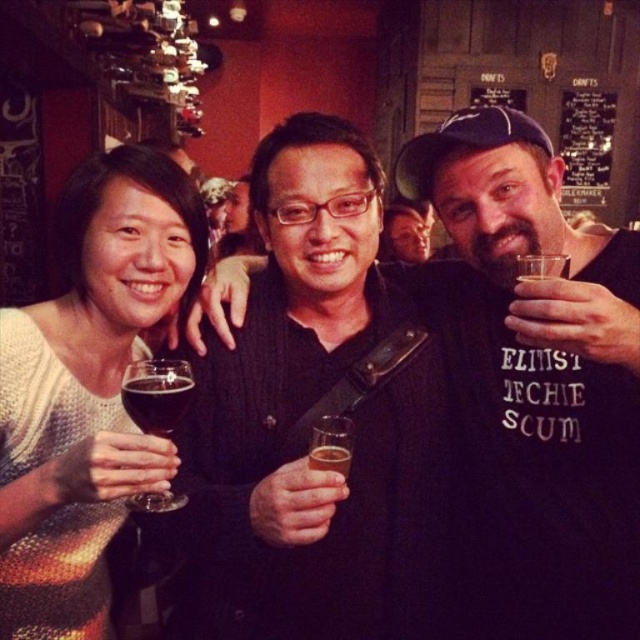
Question: Does dark glass at center appear on the right side of translucent glass at center?

Choices:
 (A) yes
 (B) no

Answer: (B)

Question: Which object is the closest to the black matte shirt at center?

Choices:
 (A) dark glass at center
 (B) knitted sweater at left
 (C) translucent glass at center

Answer: (C)

Question: Estimate the real-world distances between objects in this image. Which object is farther from the black matte shirt at center?

Choices:
 (A) dark glass at left
 (B) knitted sweater at left
 (C) dark glass at center
 (D) translucent glass at center

Answer: (B)

Question: Can you confirm if knitted sweater at left is positioned to the right of black matte shirt at center?

Choices:
 (A) yes
 (B) no

Answer: (B)

Question: Which point is farther to the camera?

Choices:
 (A) (225, 332)
 (B) (308, 456)

Answer: (A)

Question: Observing the image, what is the correct spatial positioning of dark glass at center in reference to translucent glass at center?

Choices:
 (A) above
 (B) below

Answer: (A)